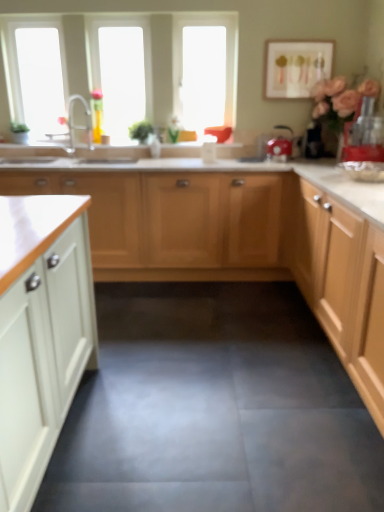
Locate an element on the screen. red plastic blender at right, which appears as the 1th appliance when viewed from the right is located at coordinates (364, 135).

Image resolution: width=384 pixels, height=512 pixels. Identify the location of translucent glass vase at upper left. (97, 114).

This screenshot has height=512, width=384. What do you see at coordinates (34, 76) in the screenshot?
I see `transparent glass window at upper left, which appears as the first window screen when viewed from the left` at bounding box center [34, 76].

Find the location of a particular element. The image size is (384, 512). white wood cabinets at center is located at coordinates (174, 223).

Describe the element at coordinates (205, 70) in the screenshot. I see `transparent plastic window screen at upper center, the 1th window screen positioned from the right` at that location.

At what (x,y) coordinates should I click in order to perform the action: click on matte white picture frame at upper right. Please return your answer as a coordinate pair (x, y). Image resolution: width=384 pixels, height=512 pixels. Looking at the image, I should click on (296, 67).

From the image's perspective, does red plastic blender at right, which appears as the 2th appliance when viewed from the left, appear lower than transparent glass window at upper left, which appears as the 2th window screen when viewed from the right?

Indeed, from the image's perspective, red plastic blender at right, which appears as the 2th appliance when viewed from the left, is shown beneath transparent glass window at upper left, which appears as the 2th window screen when viewed from the right.

This screenshot has width=384, height=512. There is a red plastic blender at right, which appears as the 2th appliance when viewed from the left. In order to click on the 2nd window screen above it (from a real-world perspective) in this screenshot , I will do `click(34, 76)`.

Which point is more forward, [361,100] or [23,45]?

Point [361,100]

Is red plastic blender at right, which appears as the first appliance when viewed from the front, next to transparent glass window at upper left, which appears as the first window screen when viewed from the left, and touching it?

red plastic blender at right, which appears as the first appliance when viewed from the front, and transparent glass window at upper left, which appears as the first window screen when viewed from the left, are clearly separated.

Which object is further away from the camera taking this photo, transparent glass window at upper left, which appears as the first window screen when viewed from the left, or red plastic blender at right, which appears as the 2th appliance when viewed from the left?

transparent glass window at upper left, which appears as the first window screen when viewed from the left, is behind.

From the image's perspective, who appears lower, transparent glass window at upper left, which appears as the 2th window screen when viewed from the right, or red plastic blender at right, which appears as the 1th appliance when viewed from the right?

red plastic blender at right, which appears as the 1th appliance when viewed from the right, appears lower in the image.

Does transparent glass window at upper left, which appears as the first window screen when viewed from the left, contain red plastic blender at right, which appears as the first appliance when viewed from the front?

Actually, red plastic blender at right, which appears as the first appliance when viewed from the front, is outside transparent glass window at upper left, which appears as the first window screen when viewed from the left.

Is transparent glass window at upper left, which appears as the first window screen when viewed from the left, in contact with red plastic blender at right, which appears as the first appliance when viewed from the front?

No, transparent glass window at upper left, which appears as the first window screen when viewed from the left, is not making contact with red plastic blender at right, which appears as the first appliance when viewed from the front.

Is translucent glass vase at upper left beside silver metallic faucet at upper left?

No, translucent glass vase at upper left is not in contact with silver metallic faucet at upper left.

Which point is more forward, [101,93] or [84,106]?

The point [101,93] is in front.

From the image's perspective, relative to silver metallic faucet at upper left, is translucent glass vase at upper left above or below?

translucent glass vase at upper left is above silver metallic faucet at upper left.

Is translucent glass vase at upper left facing away from silver metallic faucet at upper left?

No, translucent glass vase at upper left's orientation is not away from silver metallic faucet at upper left.

Considering the sizes of objects transparent plastic window screen at upper center, the second window screen viewed from the left, and transparent glass window at upper left, which appears as the first window screen when viewed from the left, in the image provided, who is taller, transparent plastic window screen at upper center, the second window screen viewed from the left, or transparent glass window at upper left, which appears as the first window screen when viewed from the left,?

transparent plastic window screen at upper center, the second window screen viewed from the left.

Would you say transparent plastic window screen at upper center, the 1th window screen positioned from the right, is outside transparent glass window at upper left, which appears as the 2th window screen when viewed from the right?

That's correct, transparent plastic window screen at upper center, the 1th window screen positioned from the right, is outside of transparent glass window at upper left, which appears as the 2th window screen when viewed from the right.

Which point is more distant from viewer, (188,85) or (47,94)?

Positioned behind is point (188,85).

Could you tell me if silver metallic faucet at upper left is facing red plastic blender at right, which appears as the 2th appliance when viewed from the left?

No, silver metallic faucet at upper left does not turn towards red plastic blender at right, which appears as the 2th appliance when viewed from the left.

Considering the positions of objects silver metallic faucet at upper left and red plastic blender at right, which appears as the 2th appliance when viewed from the left, in the image provided, who is more to the right, silver metallic faucet at upper left or red plastic blender at right, which appears as the 2th appliance when viewed from the left,?

Positioned to the right is red plastic blender at right, which appears as the 2th appliance when viewed from the left.

I want to click on the 1st appliance directly beneath the silver metallic faucet at upper left (from a real-world perspective), so click(x=364, y=135).

Is silver metallic faucet at upper left thinner than red plastic blender at right, which appears as the 1th appliance when viewed from the right?

Indeed, silver metallic faucet at upper left has a lesser width compared to red plastic blender at right, which appears as the 1th appliance when viewed from the right.

Locate an element on the screen. The width and height of the screenshot is (384, 512). picture frame on the right of silver metallic faucet at upper left is located at coordinates (296, 67).

Would you say silver metallic faucet at upper left is outside matte white picture frame at upper right?

Yes.

Can you tell me how much silver metallic faucet at upper left and matte white picture frame at upper right differ in facing direction?

silver metallic faucet at upper left and matte white picture frame at upper right are facing 0.146 degrees away from each other.

From the image's perspective, which is below, silver metallic faucet at upper left or matte white picture frame at upper right?

silver metallic faucet at upper left, from the image's perspective.

Is transparent glass window at upper center oriented towards transparent plastic window screen at upper center, the 1th window screen positioned from the right?

No, transparent glass window at upper center is not aimed at transparent plastic window screen at upper center, the 1th window screen positioned from the right.

From the image's perspective, count 1st window screens upward from the transparent glass window at upper center and point to it. Please provide its 2D coordinates.

[(205, 70)]

Looking at this image, from the image's perspective, which is below, transparent glass window at upper center or transparent plastic window screen at upper center, the second window screen viewed from the left?

transparent glass window at upper center is shown below in the image.

The height and width of the screenshot is (512, 384). I want to click on the 2nd appliance in front of the transparent glass window at upper left, which appears as the 2th window screen when viewed from the right, starting your count from the anchor, so click(x=364, y=135).

You are a GUI agent. You are given a task and a screenshot of the screen. Output one action in this format:
    pyautogui.click(x=<x>, y=<y>)
    Task: Click on the appliance that is the 1st object directly below the transparent glass window at upper left, which appears as the first window screen when viewed from the left (from a real-world perspective)
    This screenshot has width=384, height=512.
    Given the screenshot: What is the action you would take?
    pyautogui.click(x=364, y=135)

Based on the photo, looking at the image, which one is located further to white wood cabinets at center, red plastic blender at right, which appears as the first appliance when viewed from the front, or silver metallic faucet at upper left?

Based on the image, silver metallic faucet at upper left appears to be further to white wood cabinets at center.

From the image, which object appears to be nearer to transparent glass window at upper left, which appears as the 2th window screen when viewed from the right, white wood cabinets at center or transparent glass window at upper center?

transparent glass window at upper center.

Considering their positions, is translucent glass vase at upper left positioned closer to red plastic blender at right, which appears as the 1th appliance when viewed from the right, than transparent glass window at upper center?

transparent glass window at upper center.

Looking at the image, which one is located closer to red plastic blender at right, which appears as the 1th appliance when viewed from the right, white wood cabinets at center or transparent glass window at upper left, which appears as the first window screen when viewed from the left?

white wood cabinets at center is positioned closer to the anchor red plastic blender at right, which appears as the 1th appliance when viewed from the right.

Estimate the real-world distances between objects in this image. Which object is closer to transparent glass window at upper left, which appears as the first window screen when viewed from the left, transparent plastic window screen at upper center, the 1th window screen positioned from the right, or shiny red kettle at center, the second appliance from the front?

Among the two, transparent plastic window screen at upper center, the 1th window screen positioned from the right, is located nearer to transparent glass window at upper left, which appears as the first window screen when viewed from the left.

Based on their spatial positions, is red plastic blender at right, which appears as the 1th appliance when viewed from the right, or transparent glass window at upper center further from white wood cabinets at center?

Based on the image, red plastic blender at right, which appears as the 1th appliance when viewed from the right, appears to be further to white wood cabinets at center.

Looking at the image, which one is located further to translucent glass vase at upper left, white wood cabinets at center or matte white picture frame at upper right?

Among the two, matte white picture frame at upper right is located further to translucent glass vase at upper left.

Looking at this image, which object lies nearer to the anchor point transparent plastic window screen at upper center, the second window screen viewed from the left, red plastic blender at right, which appears as the 1th appliance when viewed from the right, or transparent glass window at upper left, which appears as the first window screen when viewed from the left?

Based on the image, transparent glass window at upper left, which appears as the first window screen when viewed from the left, appears to be nearer to transparent plastic window screen at upper center, the second window screen viewed from the left.

Locate an element on the screen. The image size is (384, 512). picture frame between white wood cabinets at center and red plastic blender at right, which appears as the 1th appliance when viewed from the right, in the horizontal direction is located at coordinates (296, 67).

This screenshot has width=384, height=512. Identify the location of window located between translucent glass vase at upper left and matte white picture frame at upper right in the left-right direction. (120, 72).

This screenshot has height=512, width=384. In order to click on window between transparent glass window at upper left, which appears as the 2th window screen when viewed from the right, and matte white picture frame at upper right in this screenshot , I will do `click(120, 72)`.

This screenshot has width=384, height=512. Find the location of `window screen situated between silver metallic faucet at upper left and red plastic blender at right, acting as the second appliance starting from the back, from left to right`. window screen situated between silver metallic faucet at upper left and red plastic blender at right, acting as the second appliance starting from the back, from left to right is located at coordinates (205, 70).